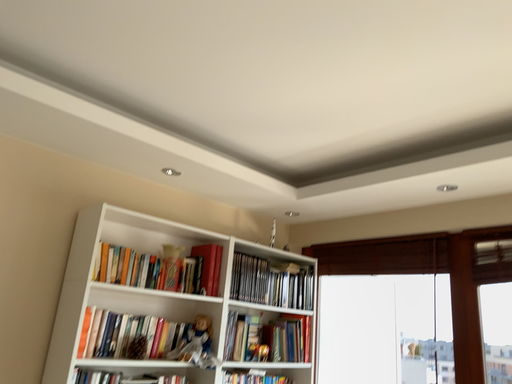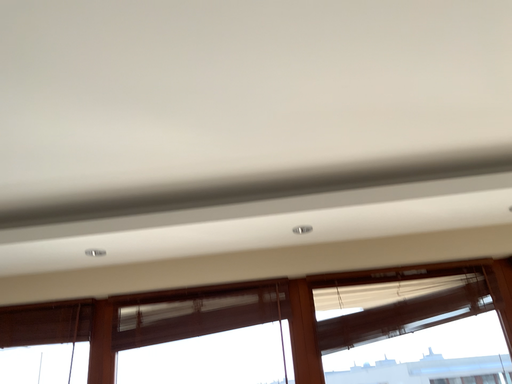
Question: How did the camera likely rotate when shooting the video?

Choices:
 (A) rotated left
 (B) rotated right

Answer: (B)